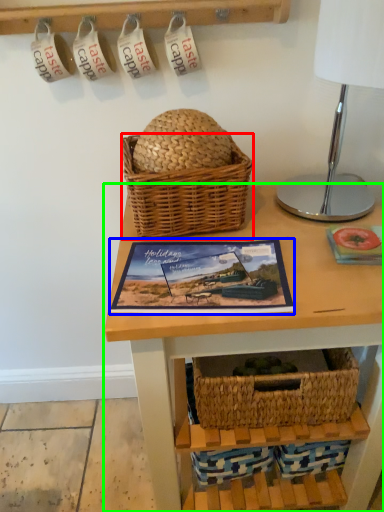
Question: Considering the real-world distances, which object is farthest from picnic basket (highlighted by a red box)? picture frame (highlighted by a blue box) or table (highlighted by a green box)?

Choices:
 (A) picture frame
 (B) table

Answer: (B)